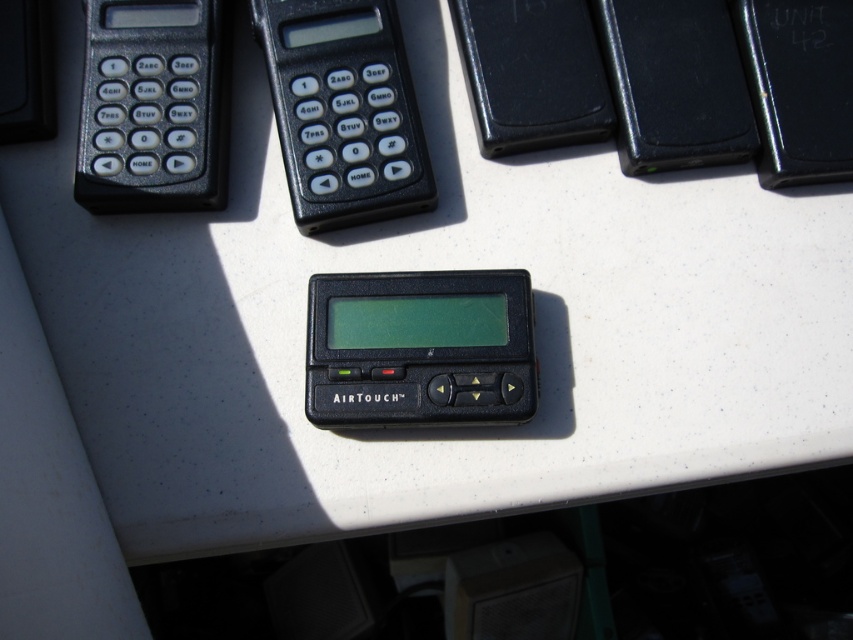
Can you confirm if black plastic calculator at upper center is positioned to the left of black plastic calculator at upper left?

In fact, black plastic calculator at upper center is to the right of black plastic calculator at upper left.

Based on the photo, is black plastic calculator at upper center below black plastic calculator at upper left?

Actually, black plastic calculator at upper center is above black plastic calculator at upper left.

I want to click on black plastic calculator at upper center, so 343,109.